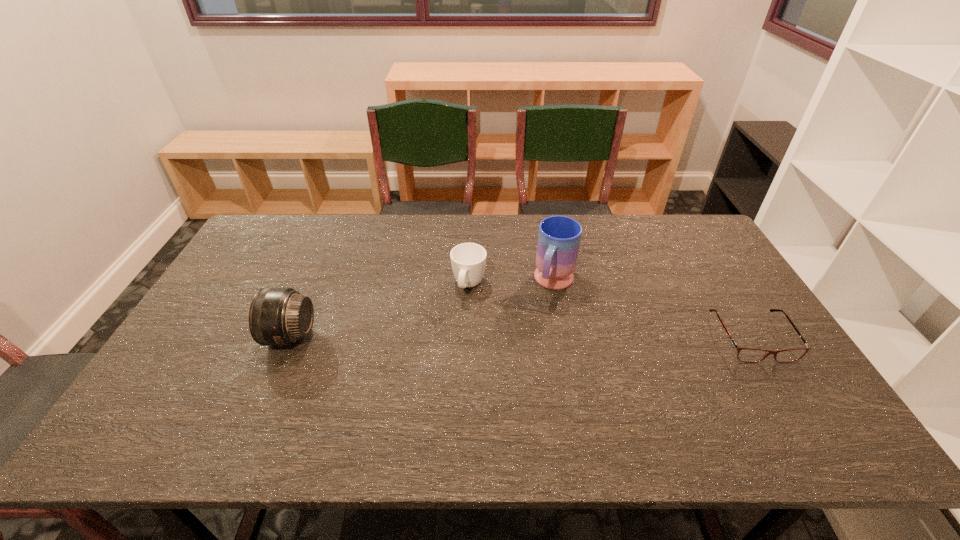
Where is `vacant space at the left edge`? This screenshot has width=960, height=540. vacant space at the left edge is located at coordinates (x=238, y=268).

Identify the location of vacant space at the right edge. This screenshot has width=960, height=540. [x=693, y=280].

In the image, there is a desktop. Identify the location of vacant space at the far left corner. This screenshot has height=540, width=960. click(x=253, y=250).

Where is `vacant position at the far right corner of the desktop`? The width and height of the screenshot is (960, 540). vacant position at the far right corner of the desktop is located at coordinates (678, 225).

The width and height of the screenshot is (960, 540). What are the coordinates of `vacant space at the near right corner` in the screenshot? It's located at (797, 405).

The height and width of the screenshot is (540, 960). Find the location of `vacant point located between the tallest object and the cup`. vacant point located between the tallest object and the cup is located at coordinates (512, 284).

This screenshot has width=960, height=540. What are the coordinates of `vacant area that lies between the mug and the telephoto lens` in the screenshot? It's located at (422, 309).

Identify the location of vacant region between the mug and the cup. (512, 284).

This screenshot has width=960, height=540. What are the coordinates of `free space between the second shortest object and the shortest object` in the screenshot? It's located at (611, 312).

In order to click on empty space between the telephoto lens and the third object from left to right in this screenshot , I will do `click(422, 309)`.